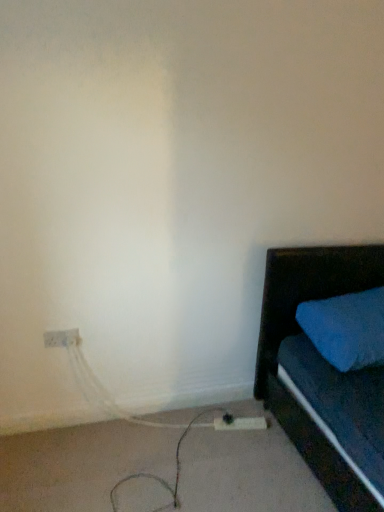
Where is `free space above white matte cable at lower left (from a real-world perspective)`? free space above white matte cable at lower left (from a real-world perspective) is located at coordinates (161, 462).